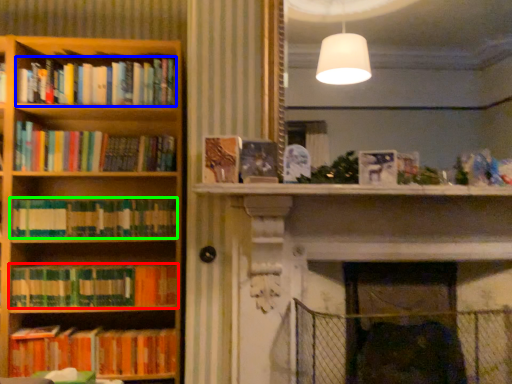
Question: Considering the real-world distances, which object is farthest from book (highlighted by a red box)? book (highlighted by a blue box) or book (highlighted by a green box)?

Choices:
 (A) book
 (B) book

Answer: (A)